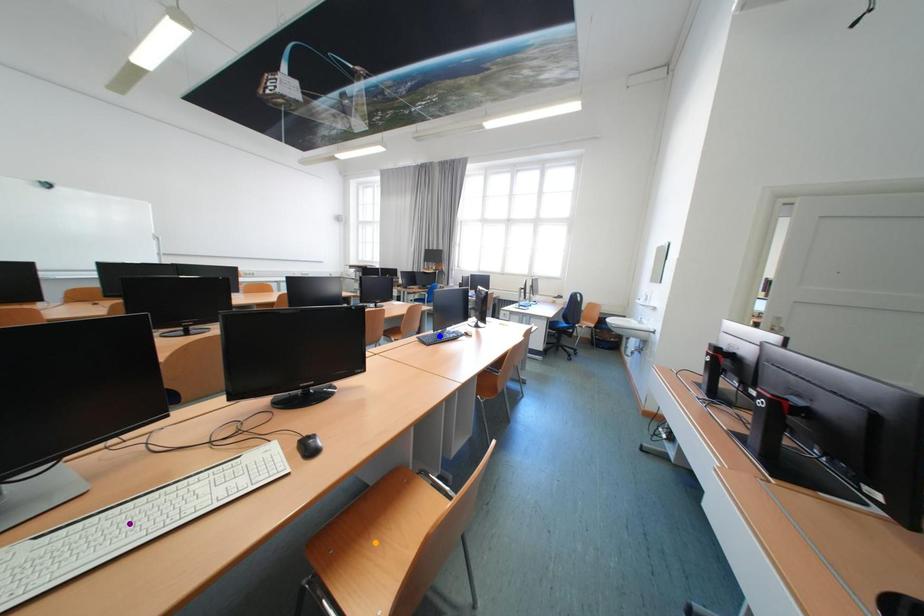
Order these from nearest to farthest:
A) blue point
B) purple point
C) orange point

purple point < orange point < blue point